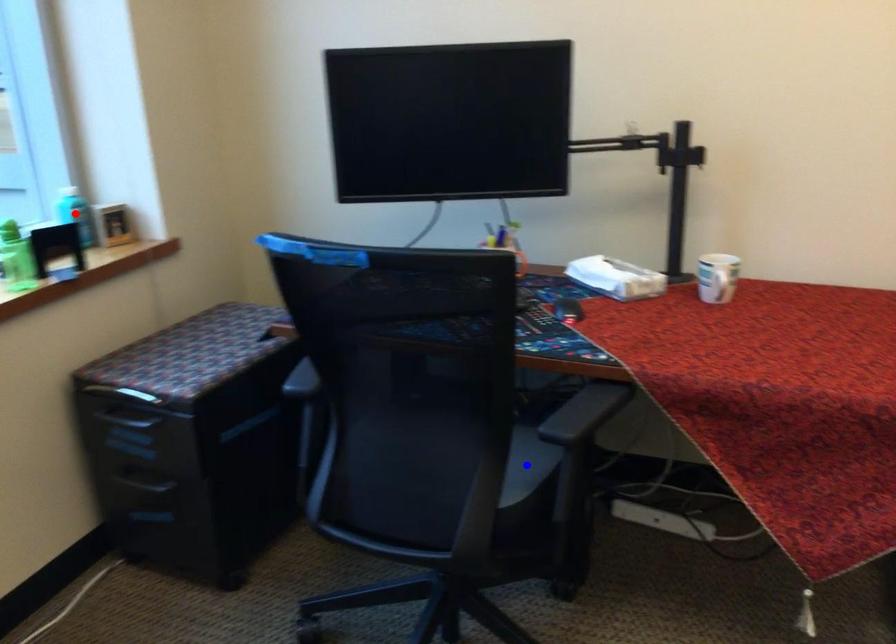
Question: Which of the two points in the image is closer to the camera?

Choices:
 (A) Blue point is closer.
 (B) Red point is closer.

Answer: (A)